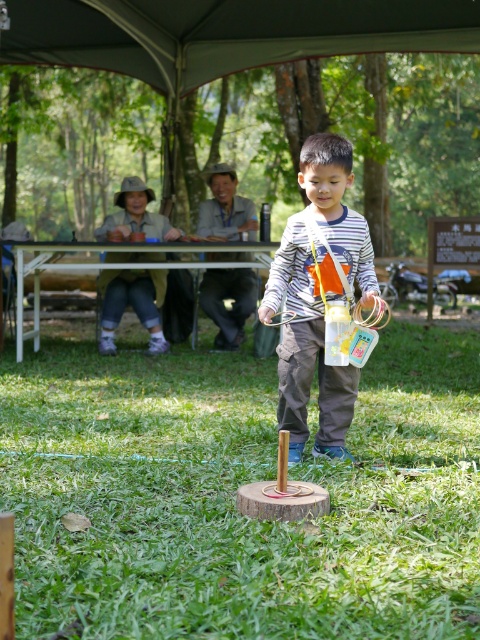
Question: Which of these objects is positioned closest to the green grass at center?

Choices:
 (A) white plastic picnic table at upper center
 (B) striped fabric shirt at center

Answer: (B)

Question: Which point appears farthest from the camera in this image?

Choices:
 (A) (x=305, y=371)
 (B) (x=107, y=60)
 (C) (x=387, y=438)

Answer: (B)

Question: Can you confirm if green grass at center is wider than dark gray fabric canopy at upper center?

Choices:
 (A) no
 (B) yes

Answer: (A)

Question: Based on their relative distances, which object is farther from the striped fabric shirt at center?

Choices:
 (A) dark gray fabric canopy at upper center
 (B) green grass at center

Answer: (A)

Question: Observing the image, what is the correct spatial positioning of green grass at center in reference to white plastic picnic table at upper center?

Choices:
 (A) above
 (B) below

Answer: (B)

Question: From the image, what is the correct spatial relationship of green grass at center in relation to dark gray fabric canopy at upper center?

Choices:
 (A) left
 (B) right

Answer: (A)